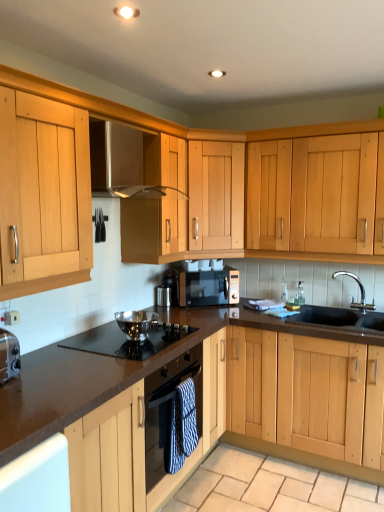
Question: From the image's perspective, is matte black microwave at center above or below satin stainless steel exhaust hood at upper center?

Choices:
 (A) below
 (B) above

Answer: (A)

Question: Considering the positions of matte black microwave at center and satin stainless steel exhaust hood at upper center in the image, is matte black microwave at center taller or shorter than satin stainless steel exhaust hood at upper center?

Choices:
 (A) short
 (B) tall

Answer: (A)

Question: Which of these objects is positioned closest to the black granite sink at lower right?

Choices:
 (A) brown laminate countertop at center
 (B) matte black microwave at center
 (C) polished stainless steel bowl at center
 (D) polished stainless steel gas stove at center
 (E) wooden cabinet at center, which ranks as the 1th cabinetry in front-to-back order

Answer: (B)

Question: Estimate the real-world distances between objects in this image. Which object is closer to the light wood cabinet at center, marked as the second cabinetry in a bottom-to-top arrangement?

Choices:
 (A) polished stainless steel gas stove at center
 (B) satin stainless steel exhaust hood at upper center
 (C) beige stone granite at lower center
 (D) brown laminate countertop at center
 (E) black granite sink at lower right

Answer: (B)